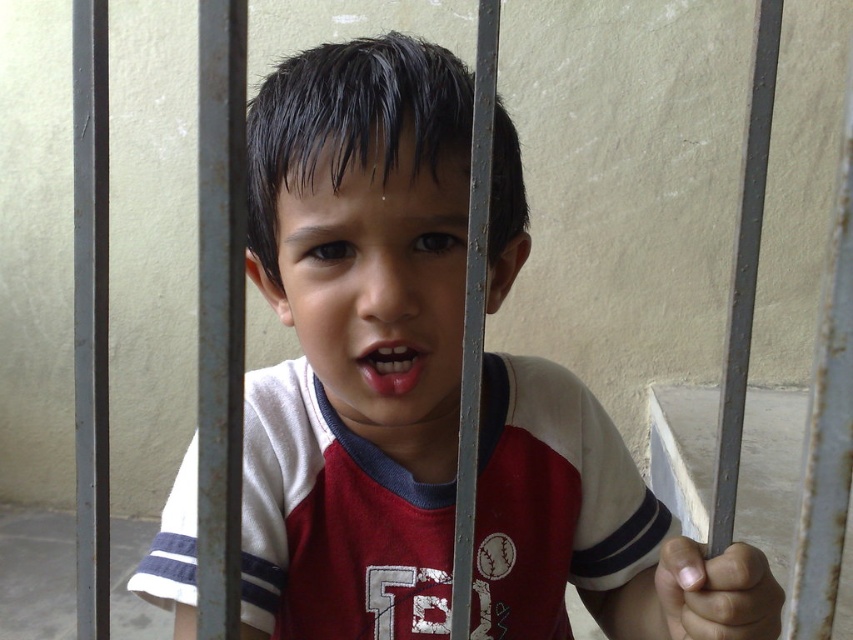
In the scene shown: You are a photographer standing in front of the white cotton shirt at center. You want to take a clear photo of the shirt without any blur. What is the minimum distance you should maintain to avoid blurriness?

The minimum distance you should maintain is 16.23 inches to avoid blurriness, as the white cotton shirt at center and viewer are 16.23 inches apart from each other.

The child in the image has a smooth skin face at center and pink glossy lips at center. Which of these is positioned higher on the child?

The smooth skin face at center is positioned higher than the pink glossy lips at center.